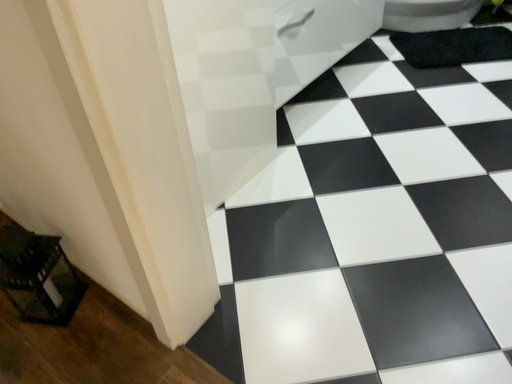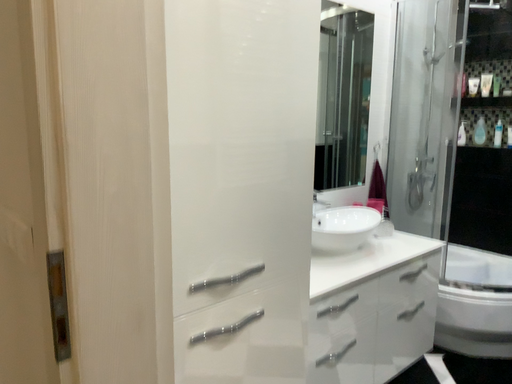
Question: Which way did the camera rotate in the video?

Choices:
 (A) rotated downward
 (B) rotated upward

Answer: (B)